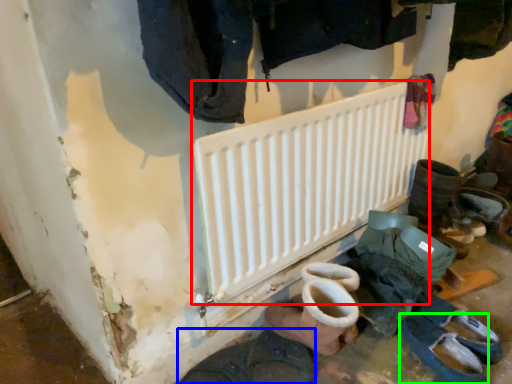
Question: Based on their relative distances, which object is farther from radiator (highlighted by a red box)? Choose from footwear (highlighted by a blue box) and footwear (highlighted by a green box).

Choices:
 (A) footwear
 (B) footwear

Answer: (B)